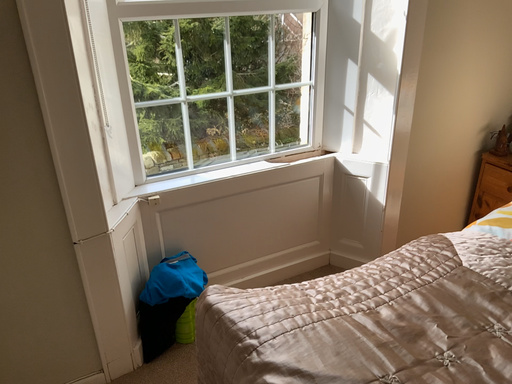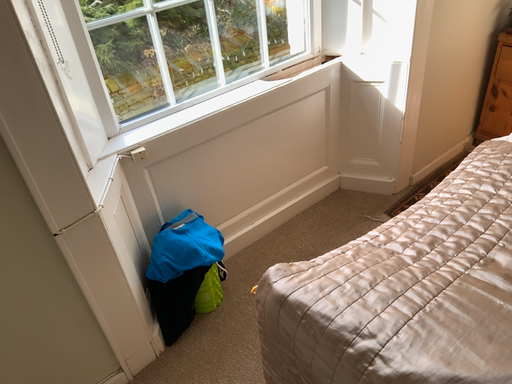
Question: Which way did the camera rotate in the video?

Choices:
 (A) rotated left
 (B) rotated right

Answer: (B)